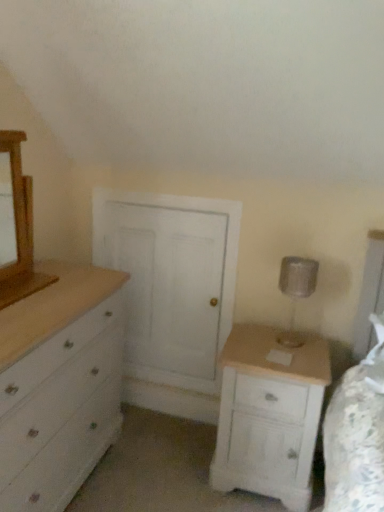
Where is `blank space to the left of silver metallic table lamp at right`? The height and width of the screenshot is (512, 384). blank space to the left of silver metallic table lamp at right is located at coordinates (261, 340).